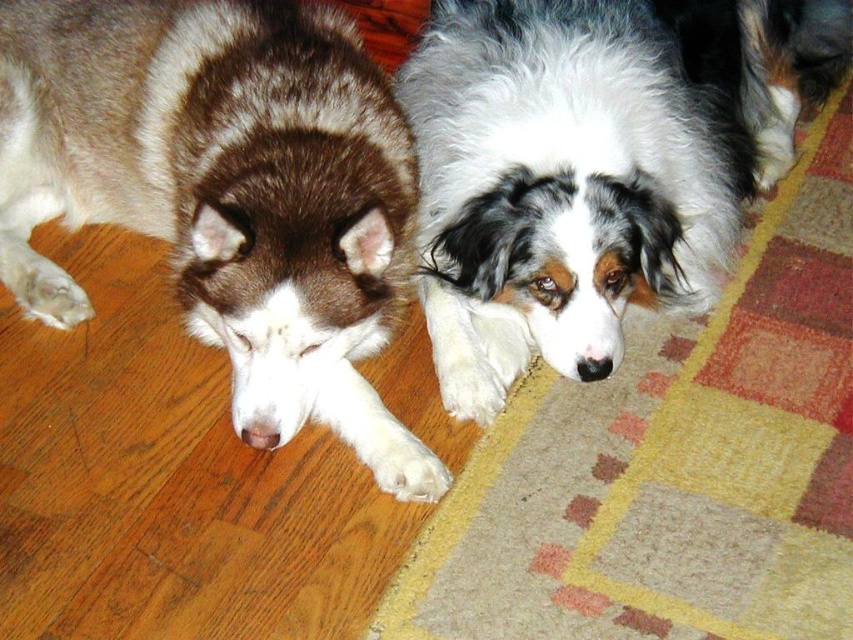
Is point (195, 232) farther from camera compared to point (733, 204)?

No, it is in front of (733, 204).

Who is shorter, brown and white fur at left or white fluffy dog at center?

white fluffy dog at center is shorter.

Is point (86, 108) positioned after point (444, 45)?

That is True.

The width and height of the screenshot is (853, 640). Find the location of `brown and white fur at left`. brown and white fur at left is located at coordinates (225, 193).